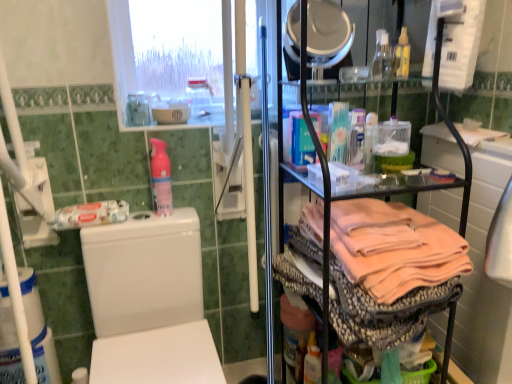
Question: From the image's perspective, is white glossy mirror at upper center beneath white glossy bowl at upper center?

Choices:
 (A) no
 (B) yes

Answer: (A)

Question: Is white glossy mirror at upper center shorter than white glossy bowl at upper center?

Choices:
 (A) yes
 (B) no

Answer: (B)

Question: Is white glossy mirror at upper center facing towards white glossy bowl at upper center?

Choices:
 (A) yes
 (B) no

Answer: (B)

Question: Can you confirm if white glossy mirror at upper center is smaller than white glossy bowl at upper center?

Choices:
 (A) yes
 (B) no

Answer: (B)

Question: Considering the relative sizes of white glossy mirror at upper center and white glossy bowl at upper center in the image provided, is white glossy mirror at upper center thinner than white glossy bowl at upper center?

Choices:
 (A) no
 (B) yes

Answer: (A)

Question: Considering the positions of transparent plastic spray bottle at upper center, the 3th bottle viewed from the left, and pink plastic spray bottle at upper center, which is the second bottle from left to right, in the image, is transparent plastic spray bottle at upper center, the 3th bottle viewed from the left, wider or thinner than pink plastic spray bottle at upper center, which is the second bottle from left to right,?

Choices:
 (A) wide
 (B) thin

Answer: (B)

Question: From the image's perspective, is transparent plastic spray bottle at upper center, the third bottle in the right-to-left sequence, located above or below pink plastic spray bottle at upper center, the 4th bottle viewed from the right?

Choices:
 (A) above
 (B) below

Answer: (A)

Question: Is point pyautogui.click(x=202, y=86) positioned closer to the camera than point pyautogui.click(x=155, y=180)?

Choices:
 (A) closer
 (B) farther

Answer: (B)

Question: Is transparent plastic spray bottle at upper center, the 3th bottle viewed from the left, in front of or behind pink plastic spray bottle at upper center, which is the second bottle from left to right, in the image?

Choices:
 (A) behind
 (B) front

Answer: (A)

Question: Considering the positions of white glossy bowl at upper center and white glossy mirror at upper center in the image, is white glossy bowl at upper center wider or thinner than white glossy mirror at upper center?

Choices:
 (A) thin
 (B) wide

Answer: (A)

Question: Is point (178, 119) positioned closer to the camera than point (314, 26)?

Choices:
 (A) farther
 (B) closer

Answer: (A)

Question: Based on their sizes in the image, would you say white glossy bowl at upper center is bigger or smaller than white glossy mirror at upper center?

Choices:
 (A) small
 (B) big

Answer: (A)

Question: From their relative heights in the image, would you say white glossy bowl at upper center is taller or shorter than white glossy mirror at upper center?

Choices:
 (A) short
 (B) tall

Answer: (A)

Question: In the image, is white glossy mirror at upper center positioned in front of or behind white mesh screen at upper center?

Choices:
 (A) front
 (B) behind

Answer: (A)

Question: In terms of width, does white glossy mirror at upper center look wider or thinner when compared to white mesh screen at upper center?

Choices:
 (A) thin
 (B) wide

Answer: (A)